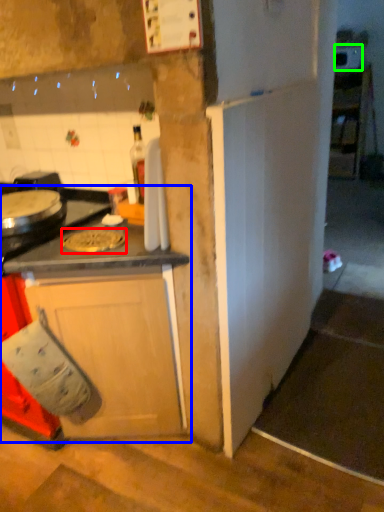
Question: Which object is positioned closest to pizza pan (highlighted by a red box)? Select from cabinetry (highlighted by a blue box) and appliance (highlighted by a green box).

Choices:
 (A) cabinetry
 (B) appliance

Answer: (A)